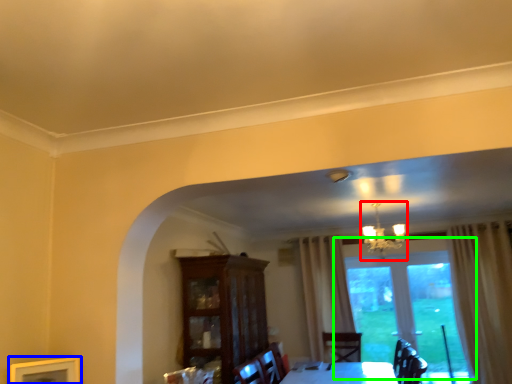
Question: Which is farther away from light fixture (highlighted by a red box)? picture frame (highlighted by a blue box) or window (highlighted by a green box)?

Choices:
 (A) picture frame
 (B) window

Answer: (A)